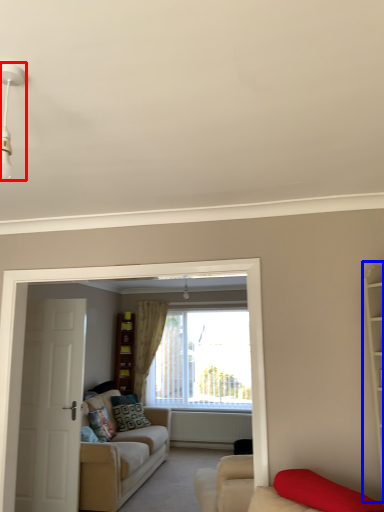
Question: Among these objects, which one is nearest to the camera, light fixture (highlighted by a red box) or bookshelf (highlighted by a blue box)?

Choices:
 (A) light fixture
 (B) bookshelf

Answer: (A)